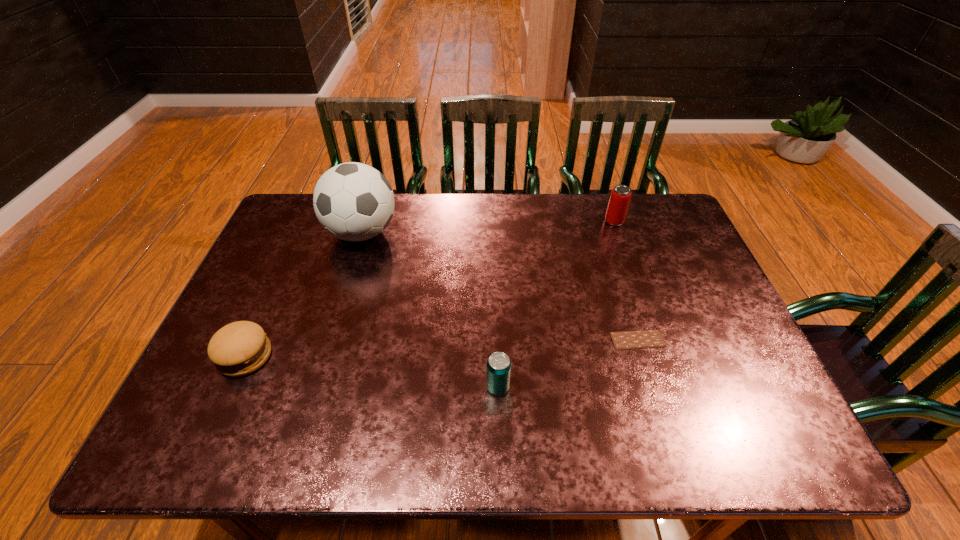
Locate an element on the screen. This screenshot has height=540, width=960. vacant region between the chocolate bar and the right beer can is located at coordinates (626, 281).

I want to click on vacant space that's between the shorter beer can and the shortest object, so click(x=567, y=363).

The width and height of the screenshot is (960, 540). In order to click on free space between the third object from left to right and the chocolate bar in this screenshot , I will do `click(567, 363)`.

Locate an element on the screen. This screenshot has width=960, height=540. vacant region between the soccer ball and the leftmost object is located at coordinates (303, 295).

Locate an element on the screen. free space between the nearer beer can and the fourth tallest object is located at coordinates (372, 372).

Where is `the fourth closest object to the fourth tallest object`? This screenshot has width=960, height=540. the fourth closest object to the fourth tallest object is located at coordinates (620, 197).

Find the location of a particular element. object that stands as the third closest to the hamburger is located at coordinates (640, 339).

What are the coordinates of `vacant region that satisfies the following two spatial constraints: 1. on the back side of the shorter beer can; 2. on the left side of the shortest object` in the screenshot? It's located at (496, 340).

This screenshot has width=960, height=540. In order to click on free location that satisfies the following two spatial constraints: 1. on the back side of the second shortest object; 2. on the left side of the second object from left to right in this screenshot , I will do `click(300, 233)`.

This screenshot has width=960, height=540. In order to click on vacant area that satisfies the following two spatial constraints: 1. on the back side of the chocolate bar; 2. on the right side of the left beer can in this screenshot , I will do (496, 340).